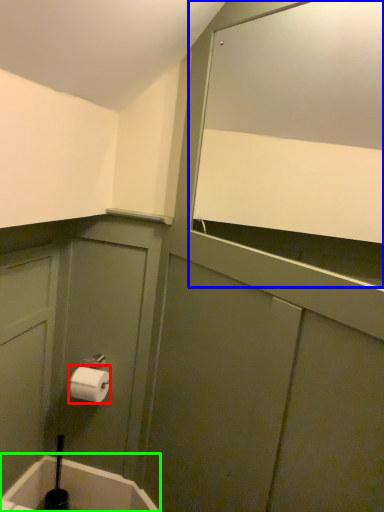
Question: Which object is the farthest from toilet paper (highlighted by a red box)? Choose among these: mirror (highlighted by a blue box) or bath (highlighted by a green box).

Choices:
 (A) mirror
 (B) bath

Answer: (A)